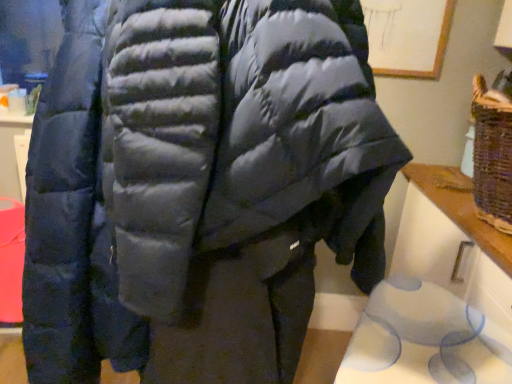
Locate an element on the screen. white paperboard at upper center is located at coordinates (407, 36).

In order to face white paperboard at upper center, should I rotate leftwards or rightwards?

To align with it, rotate right about 19.531°.

What do you see at coordinates (407, 36) in the screenshot?
I see `white paperboard at upper center` at bounding box center [407, 36].

I want to click on white paperboard at upper center, so click(x=407, y=36).